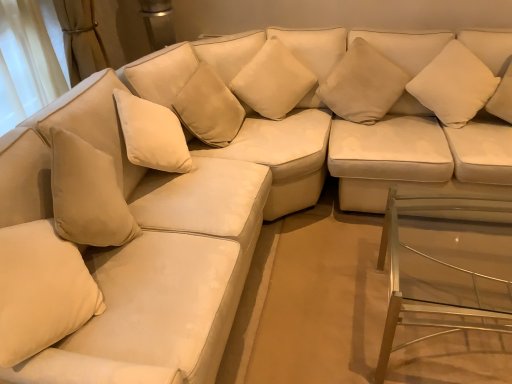
Question: Would you say clear glass table at lower right is to the left or to the right of suede beige couch at left in the picture?

Choices:
 (A) left
 (B) right

Answer: (B)

Question: Is clear glass table at lower right inside the boundaries of suede beige couch at left, or outside?

Choices:
 (A) outside
 (B) inside

Answer: (A)

Question: Based on their relative distances, which object is farther from the white soft cushion at upper right, placed as the first pillow when sorted from right to left?

Choices:
 (A) clear glass table at lower right
 (B) beige fabric pillow at upper center, which is the second pillow from right to left
 (C) suede beige couch at left
 (D) beige fabric pillow at lower left, arranged as the 4th pillow when viewed from the right
 (E) suede-like beige pillow at center, which ranks as the second pillow in left-to-right order

Answer: (D)

Question: Considering the real-world distances, which object is farthest from the suede-like beige pillow at center, which ranks as the second pillow in left-to-right order?

Choices:
 (A) white soft cushion at upper right, the fourth pillow from the left
 (B) beige fabric pillow at lower left, arranged as the 4th pillow when viewed from the right
 (C) clear glass table at lower right
 (D) beige fabric pillow at upper center, which is the second pillow from right to left
 (E) suede beige couch at left

Answer: (B)